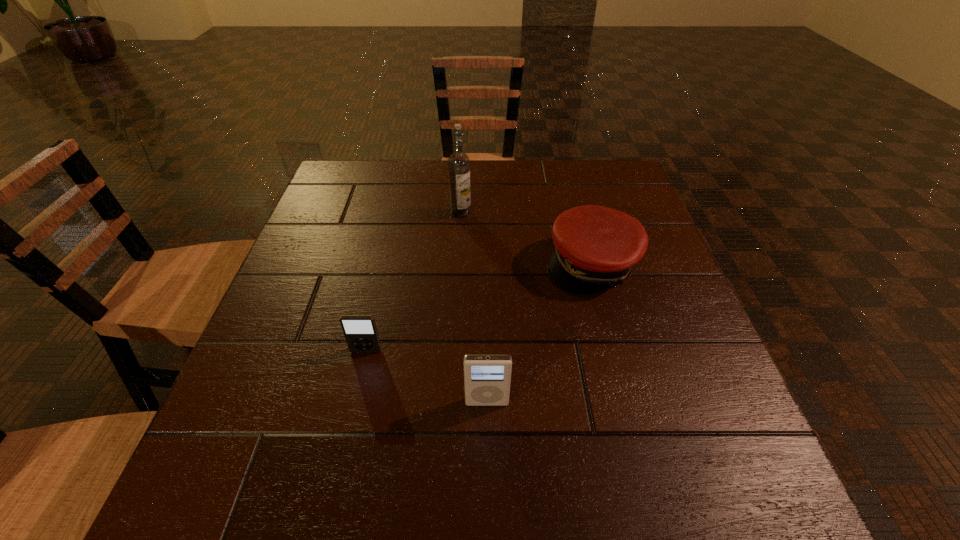
Locate an element on the screen. The height and width of the screenshot is (540, 960). object that ranks as the third closest to the farther iPod is located at coordinates (459, 163).

Identify the location of the second closest object relative to the vodka. (360, 331).